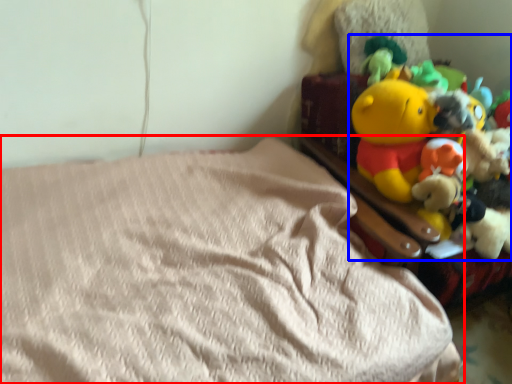
Question: Which point is further to the camera, bed (highlighted by a red box) or toy (highlighted by a blue box)?

Choices:
 (A) bed
 (B) toy

Answer: (B)